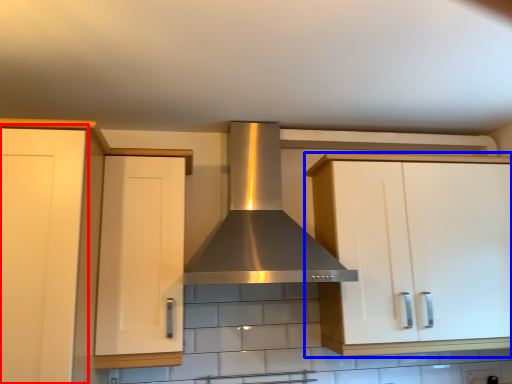
Question: Which point is further to the camera, cabinetry (highlighted by a red box) or cabinetry (highlighted by a blue box)?

Choices:
 (A) cabinetry
 (B) cabinetry

Answer: (B)